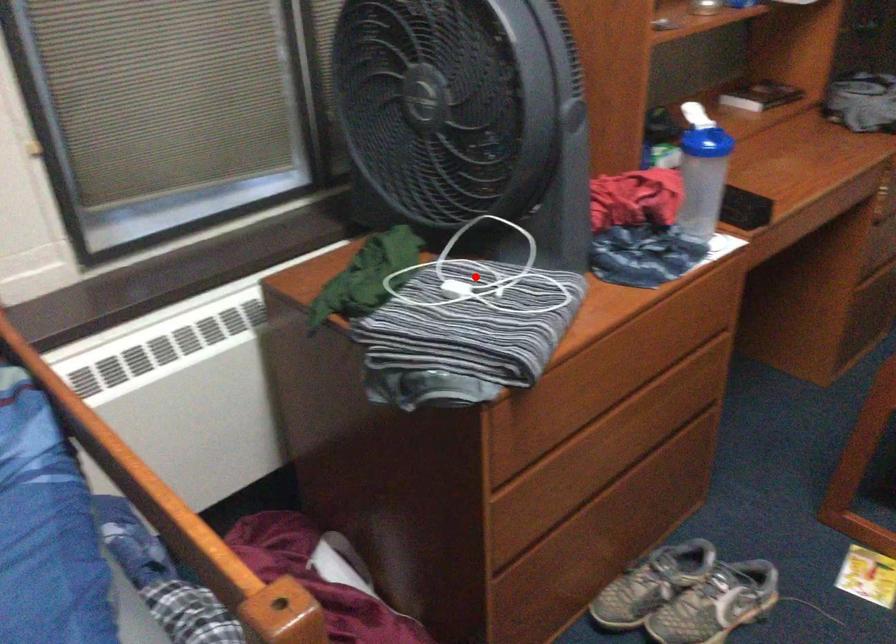
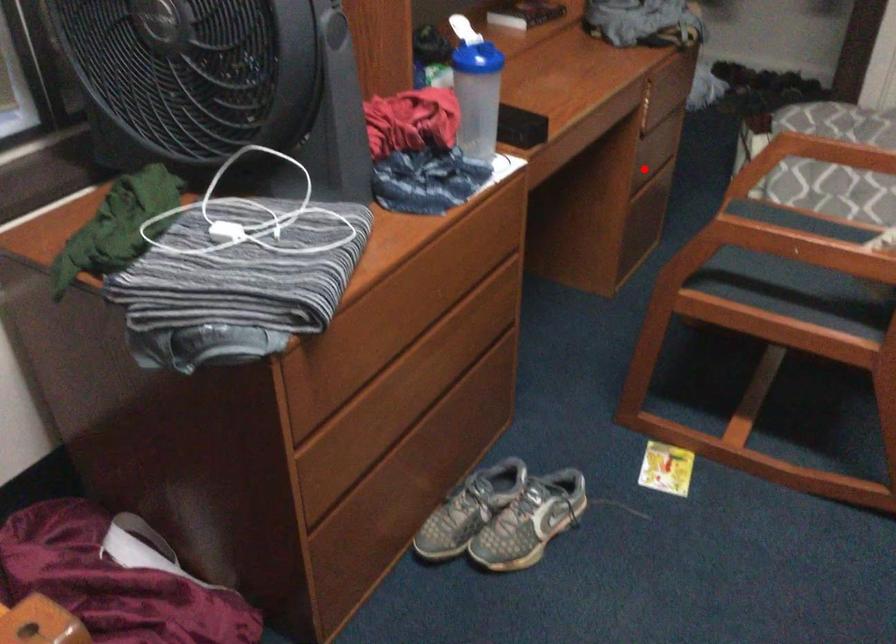
I am providing you with two images of the same scene from different viewpoints. A red point is marked on the first image and another point is marked on the second image. Is the red point in image1 aligned with the point shown in image2?

No